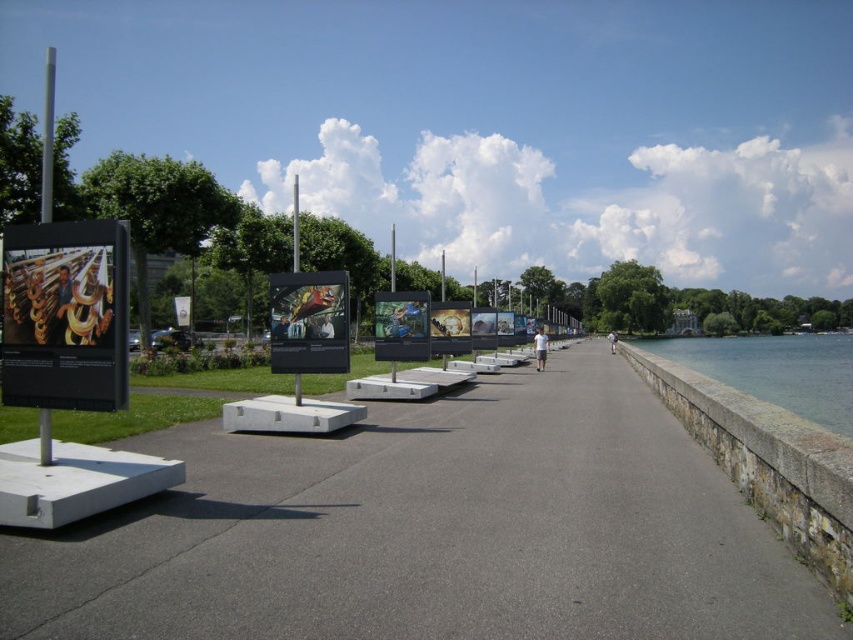
You are a photographer standing on the waterfront pathway. You want to capture a photo that includes both the metallic reflective poster at center and the white fabric person at center. Considering their heights, which object will appear taller in the photo?

The metallic reflective poster at center will appear taller in the photo since it has a greater height compared to the white fabric person at center.

You are standing at the camera position and want to read the matte black sign at left. The sign is 21.07 feet away. Can you reach it by taking 3 steps forward if each step is about 3 feet long?

The matte black sign at left is 21.07 feet away. Taking 3 steps of 3 feet each would cover 9 feet, which is insufficient to reach the sign. You would need to take more steps.

You are standing on the gray concrete path at center and want to reach the white fabric person at center. Which direction should you move to get there?

The gray concrete path at center is to the left of the white fabric person at center, so you should move to the right to reach them.